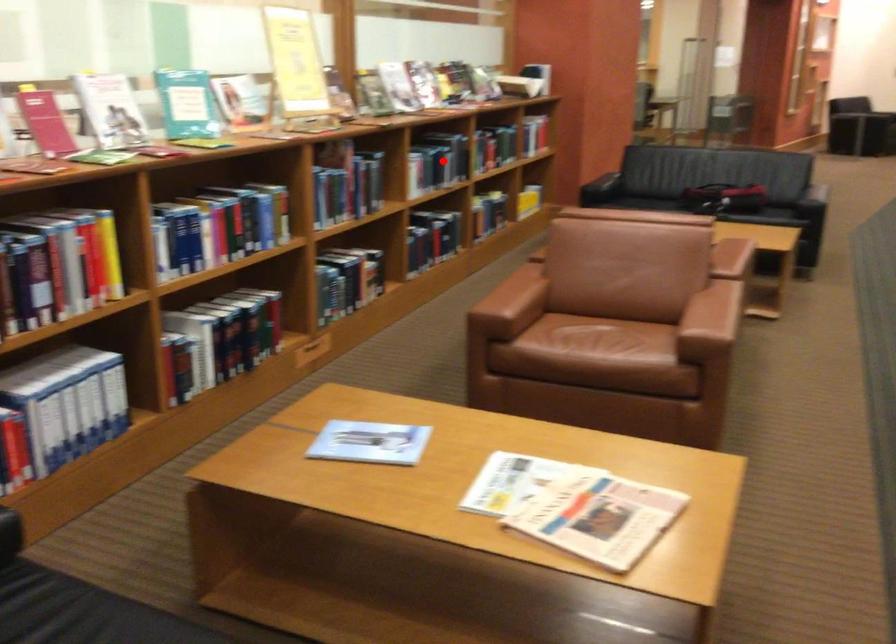
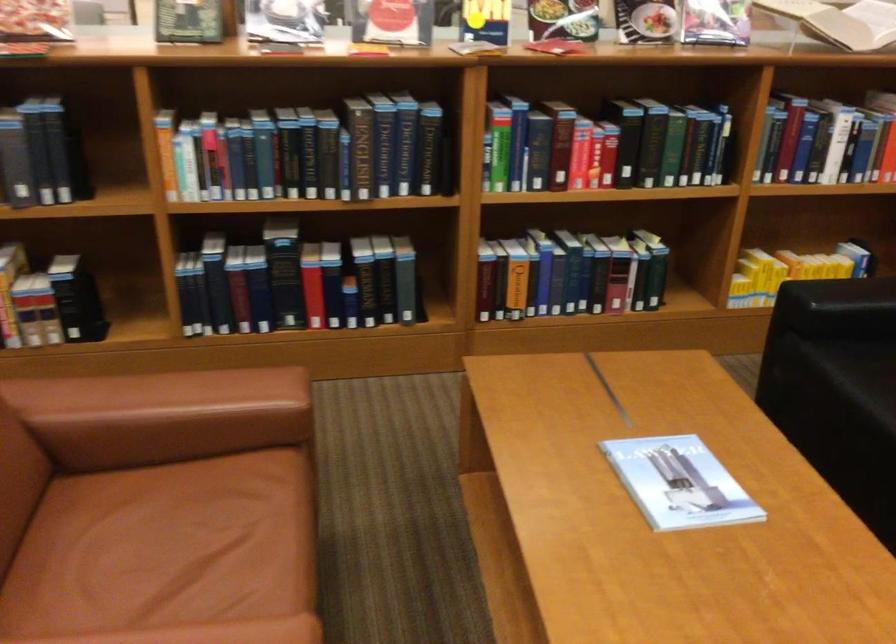
Question: I am providing you with two images of the same scene from different viewpoints. In image1, a red point is highlighted. Considering the same 3D point in image2, which of the following is correct?

Choices:
 (A) It is closer
 (B) It is farther

Answer: (A)